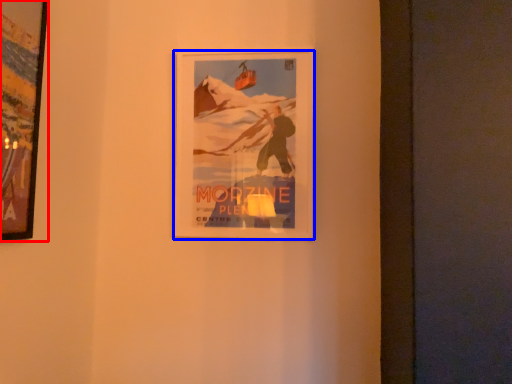
Question: Which object appears farthest to the camera in this image, picture frame (highlighted by a red box) or picture frame (highlighted by a blue box)?

Choices:
 (A) picture frame
 (B) picture frame

Answer: (B)